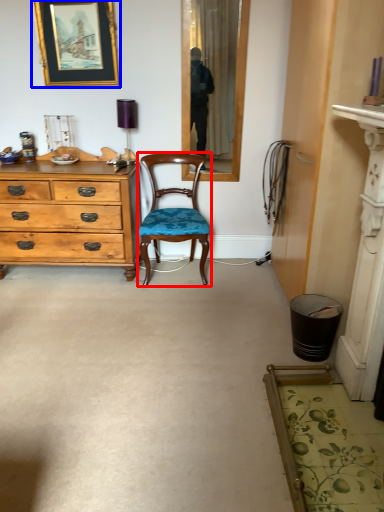
Question: Which object is closer to the camera taking this photo, chair (highlighted by a red box) or picture frame (highlighted by a blue box)?

Choices:
 (A) chair
 (B) picture frame

Answer: (A)